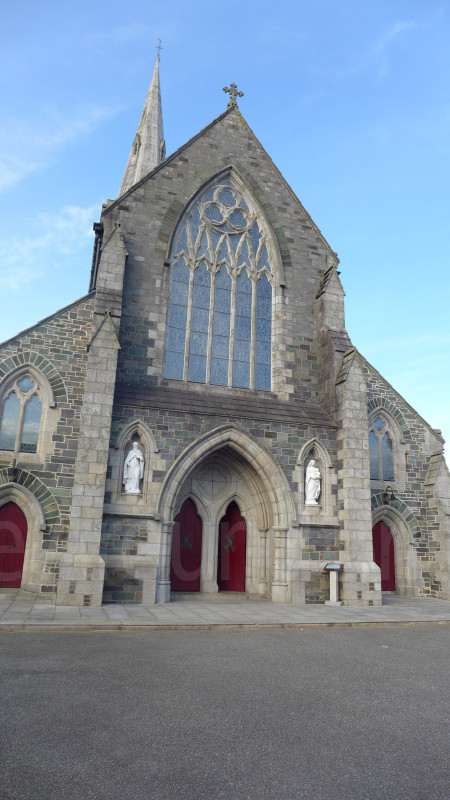
The image size is (450, 800). I want to click on archways, so click(12, 478), click(230, 436), click(386, 504).